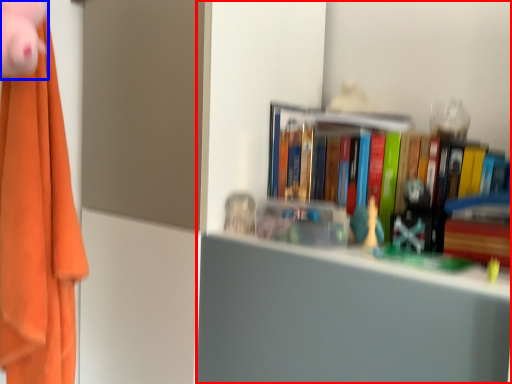
Question: Among these objects, which one is farthest to the camera, bookcase (highlighted by a red box) or toy (highlighted by a blue box)?

Choices:
 (A) bookcase
 (B) toy

Answer: (B)